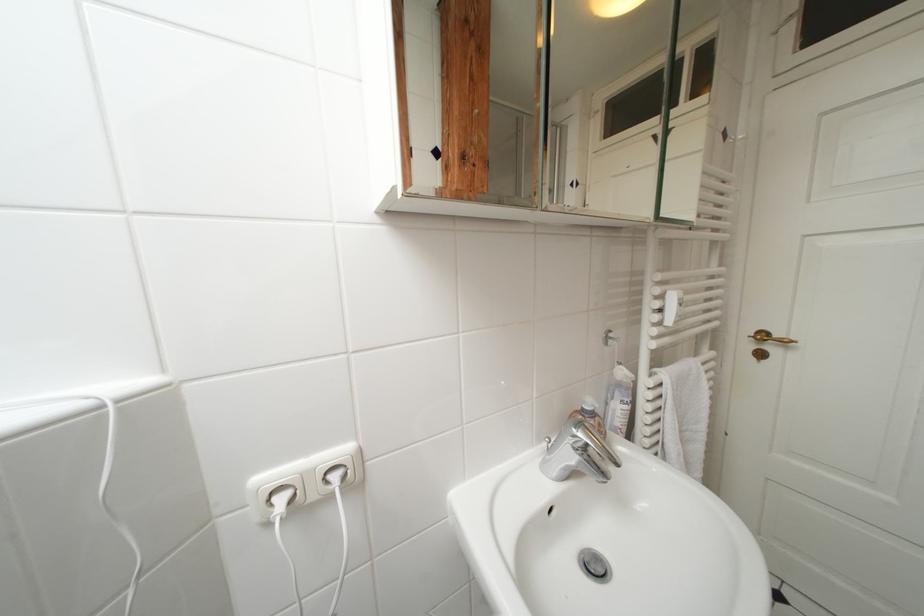
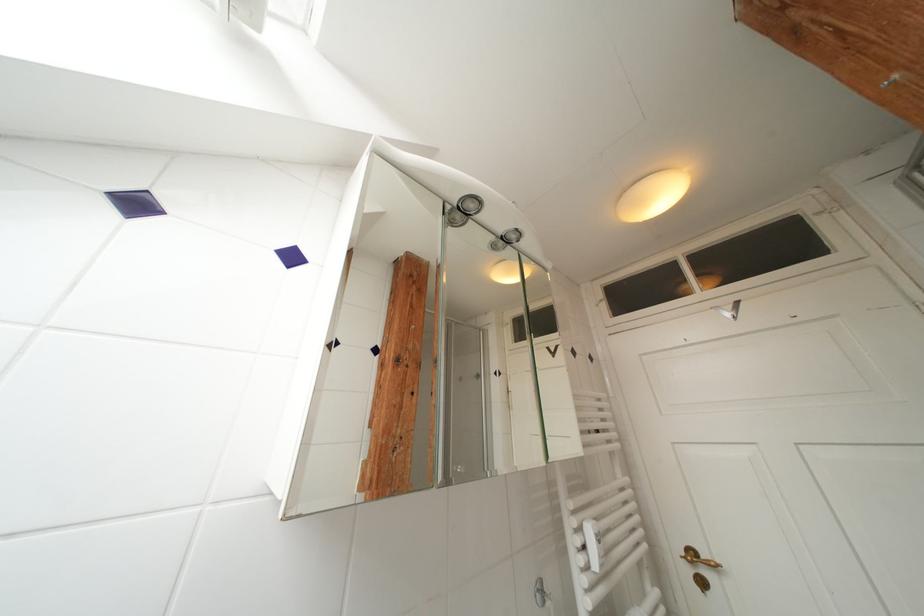
The point at (x=480, y=169) is marked in the first image. Where is the corresponding point in the second image?

(412, 370)